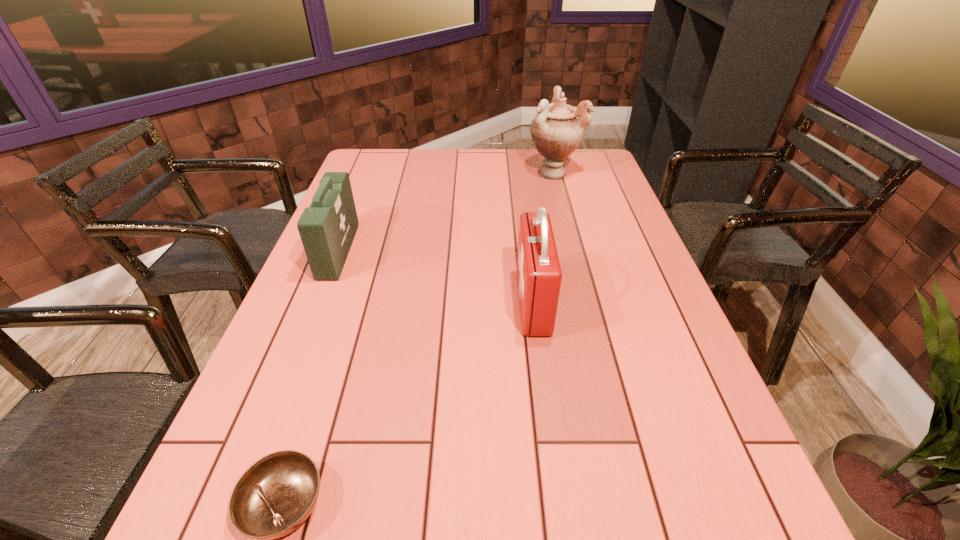
You are a GUI agent. You are given a task and a screenshot of the screen. Output one action in this format:
    pyautogui.click(x=<x>, y=<y>)
    Task: Click on the free space located 0.370m on the front-facing side of the second shortest object
    The image size is (960, 540).
    Given the screenshot: What is the action you would take?
    481,251

Find the location of a particular element. The width and height of the screenshot is (960, 540). object present at the far edge is located at coordinates (556, 131).

You are a GUI agent. You are given a task and a screenshot of the screen. Output one action in this format:
    pyautogui.click(x=<x>, y=<y>)
    Task: Click on the object present at the left edge
    This screenshot has width=960, height=540.
    Given the screenshot: What is the action you would take?
    pyautogui.click(x=327, y=228)

Find the location of `object that is at the right edge`. object that is at the right edge is located at coordinates (556, 131).

Identify the location of object that is at the far right corner. (556, 131).

At what (x,y) coordinates should I click in order to perform the action: click on free space at the far edge of the desktop. Please return your answer as a coordinate pair (x, y). This screenshot has height=540, width=960. Looking at the image, I should click on (421, 179).

What are the coordinates of `vacant space at the left edge of the desktop` in the screenshot? It's located at (343, 310).

At what (x,y) coordinates should I click in order to perform the action: click on vacant region at the right edge of the desktop. Please return your answer as a coordinate pair (x, y). Looking at the image, I should click on (606, 216).

You are a GUI agent. You are given a task and a screenshot of the screen. Output one action in this format:
    pyautogui.click(x=<x>, y=<y>)
    Task: Click on the vacant region at the far left corner of the desktop
    The height and width of the screenshot is (540, 960).
    Given the screenshot: What is the action you would take?
    pyautogui.click(x=355, y=177)

Find the location of a particular element. vacant space at the far right corner of the desktop is located at coordinates click(x=566, y=167).